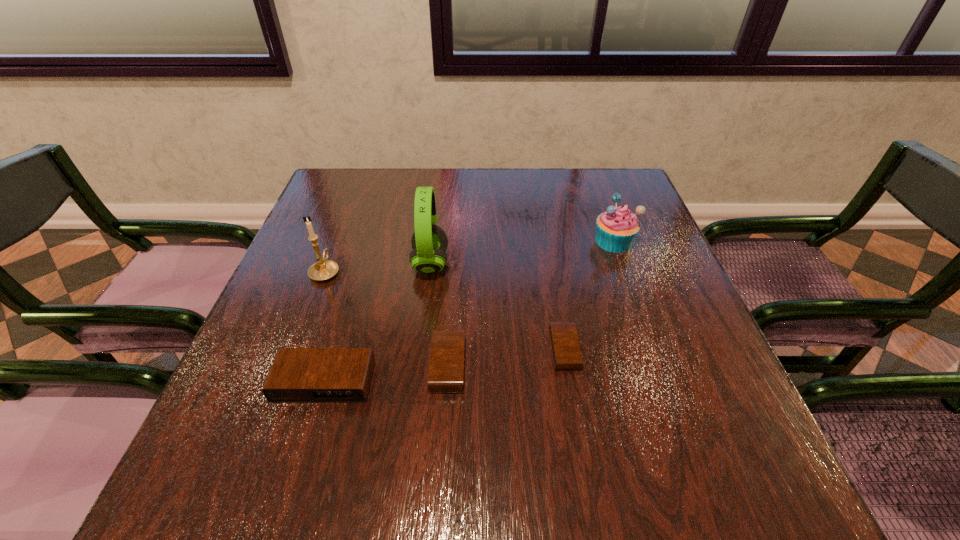
This screenshot has width=960, height=540. I want to click on candle holder present at the left edge, so click(x=324, y=269).

Where is `object that is at the right edge`? object that is at the right edge is located at coordinates (617, 228).

Where is `object located at the near left corner`? The width and height of the screenshot is (960, 540). object located at the near left corner is located at coordinates (298, 375).

What are the coordinates of `vacant space at the far edge` in the screenshot? It's located at (431, 180).

This screenshot has width=960, height=540. Identify the location of vacant space at the near edge. (373, 399).

Find the location of a particular element. vacant space at the left edge of the desktop is located at coordinates (328, 254).

Locate an element on the screen. This screenshot has height=540, width=960. blank space at the right edge of the desktop is located at coordinates 696,317.

Find the location of a particular element. Image resolution: width=960 pixels, height=540 pixels. free space at the far left corner is located at coordinates (372, 200).

Locate an element on the screen. vacant area at the near right corner of the desktop is located at coordinates (714, 423).

This screenshot has height=540, width=960. I want to click on unoccupied position between the fourth shortest object and the candle holder, so click(469, 256).